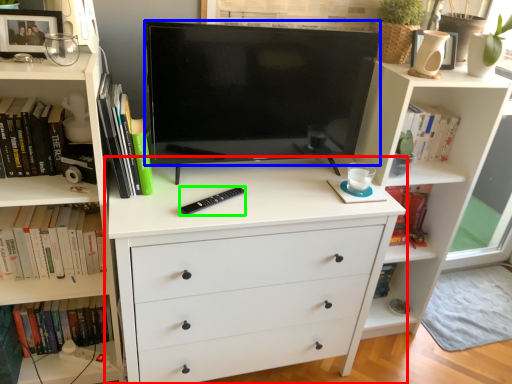
Question: Which object is the farthest from chest of drawers (highlighted by a red box)? Choose among these: television (highlighted by a blue box) or flat (highlighted by a green box).

Choices:
 (A) television
 (B) flat

Answer: (A)